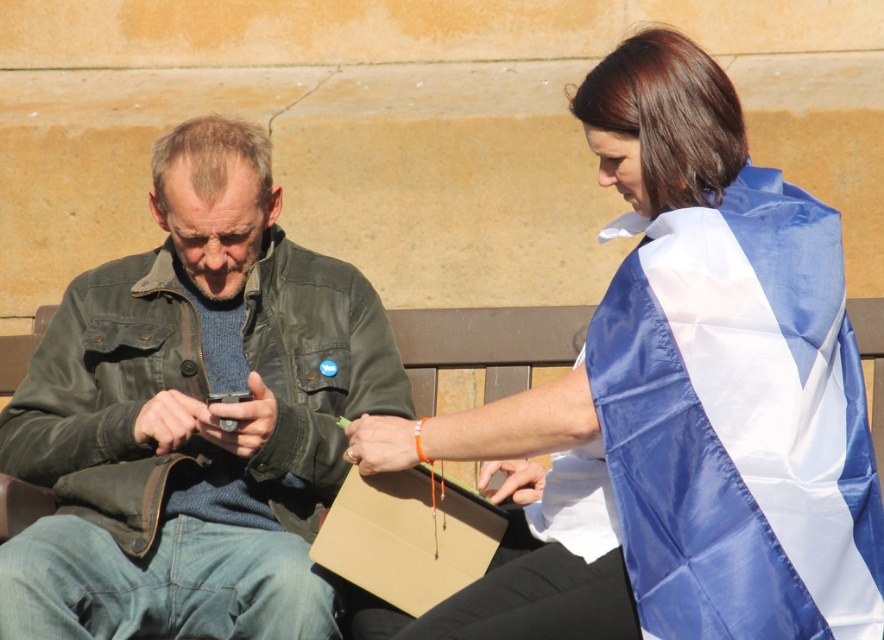
Can you confirm if blue satin flag at upper right is taller than leather jacket at left?

Yes.

Which is more to the right, blue satin flag at upper right or leather jacket at left?

blue satin flag at upper right is more to the right.

Describe the element at coordinates (684, 394) in the screenshot. I see `blue satin flag at upper right` at that location.

Locate an element on the screen. blue satin flag at upper right is located at coordinates (684, 394).